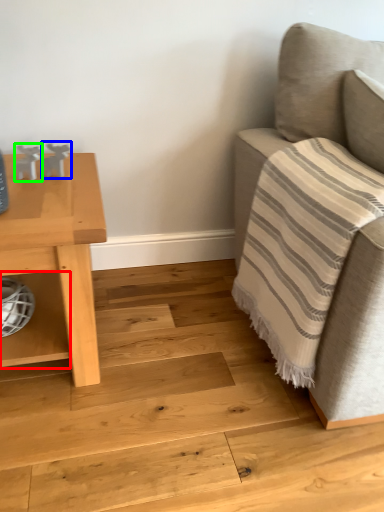
Question: Which is farther away from shelf (highlighted by a red box)? toy (highlighted by a blue box) or toy (highlighted by a green box)?

Choices:
 (A) toy
 (B) toy

Answer: (A)